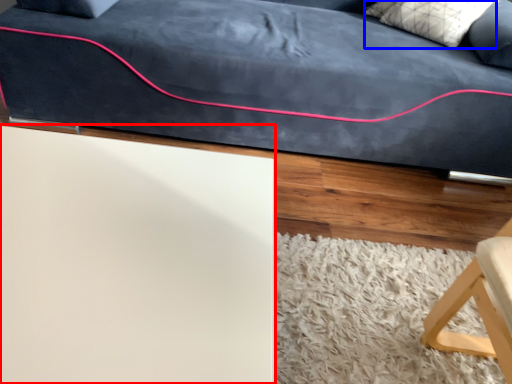
Question: Which of the following is the closest to the observer, table (highlighted by a red box) or pillow (highlighted by a blue box)?

Choices:
 (A) table
 (B) pillow

Answer: (A)